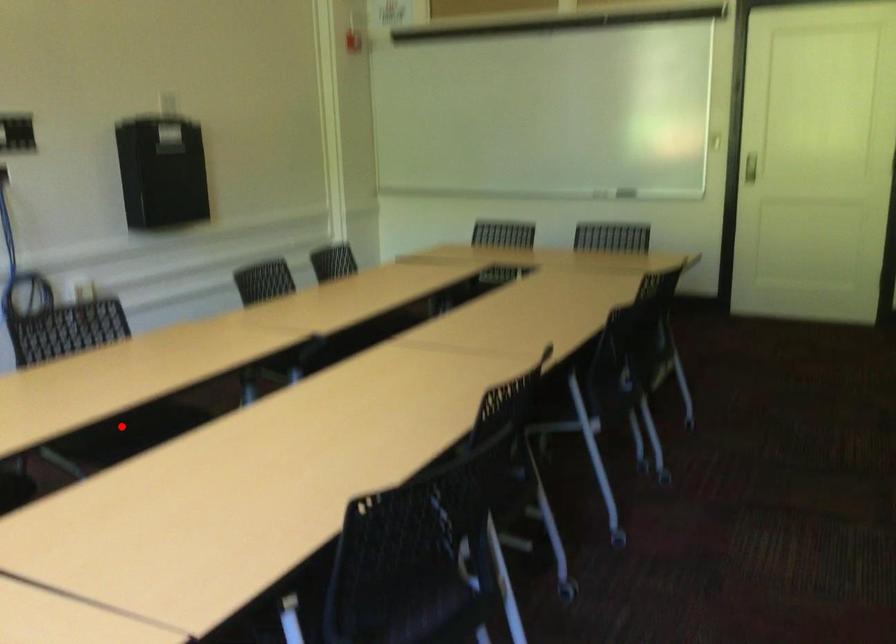
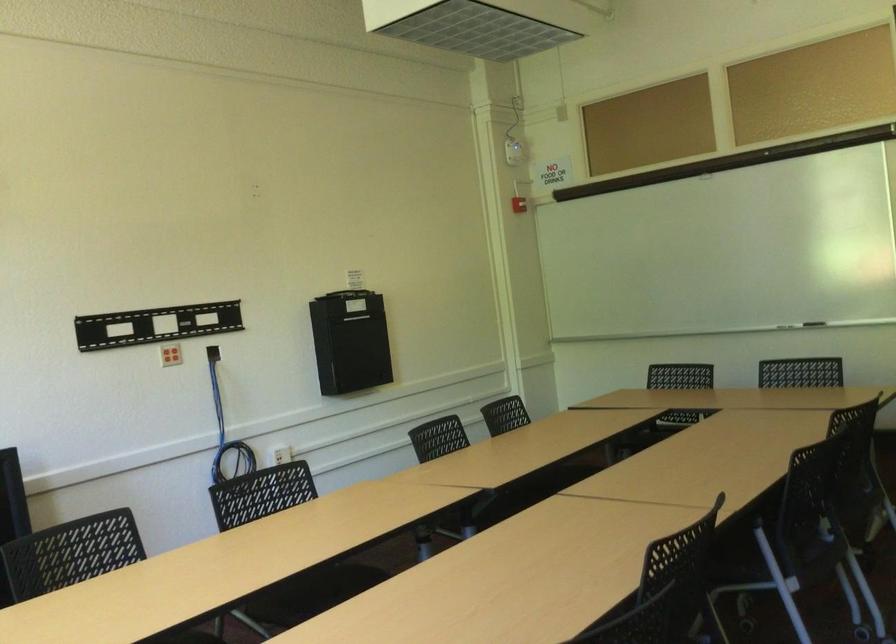
Locate, in the second image, the point that corresponds to the highlighted location in the first image.

(313, 592)